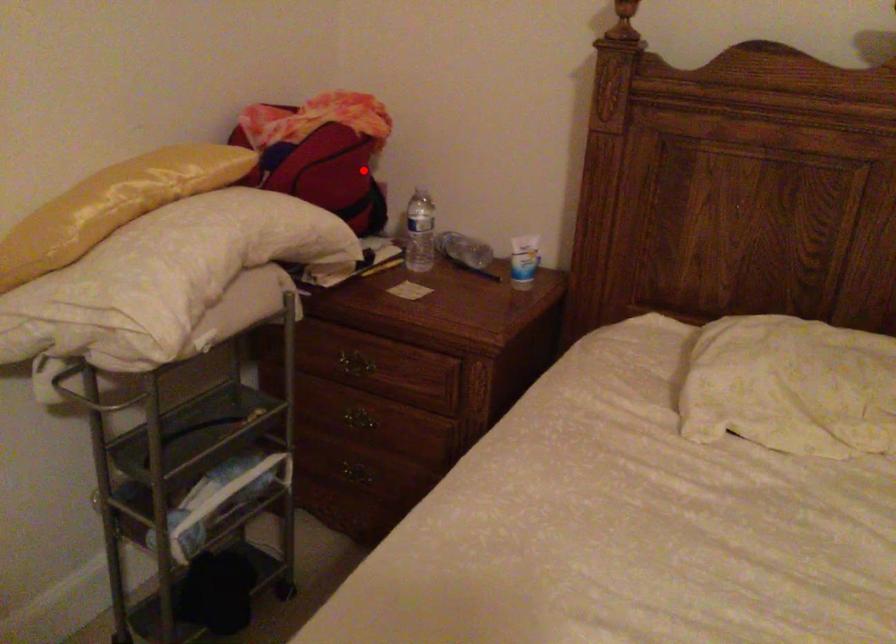
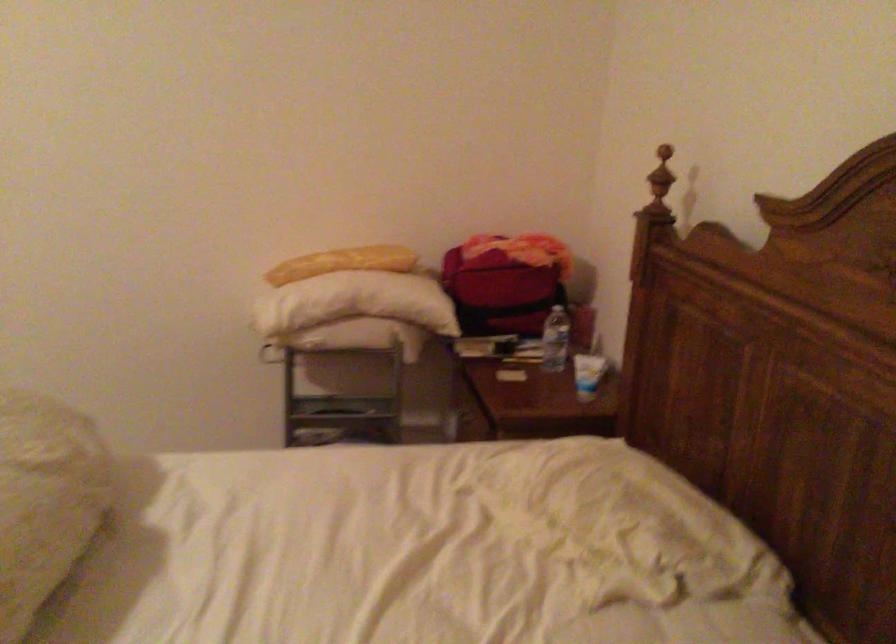
Question: I am providing you with two images of the same scene from different viewpoints. Image1 has a red point marked. In image2, the corresponding 3D location appears at what relative position? Reply with the corresponding letter.

Choices:
 (A) Closer
 (B) Farther

Answer: (B)